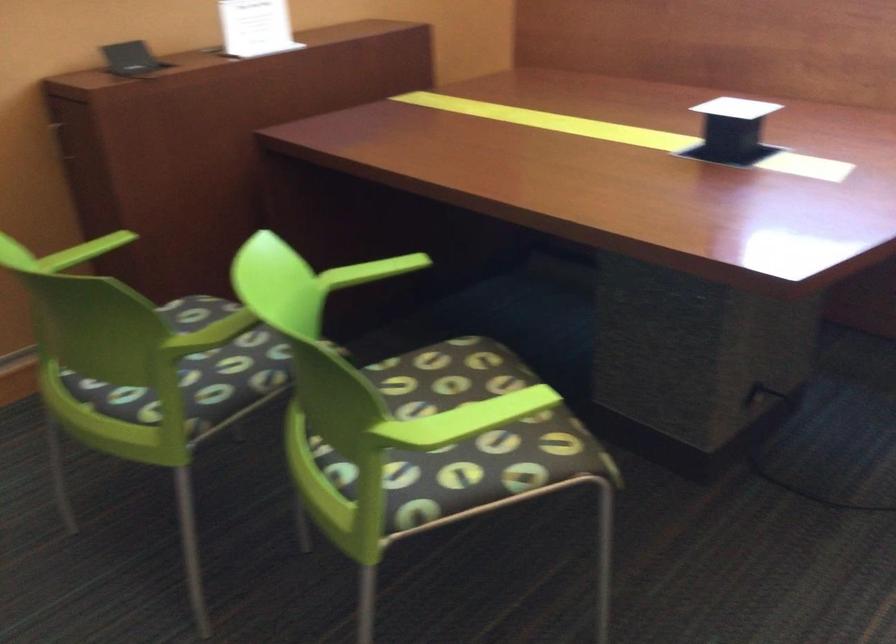
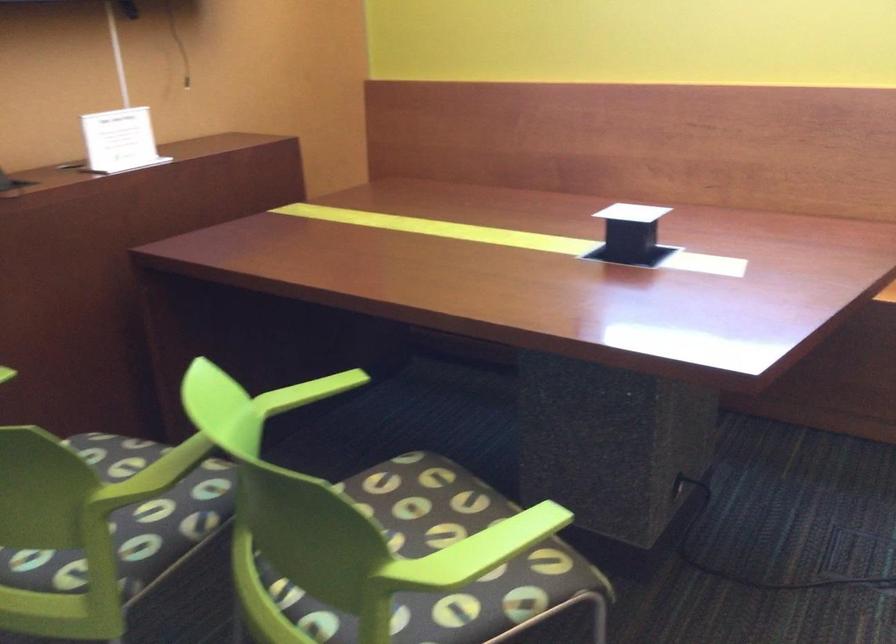
Where in the second image is the point corresponding to (373,270) from the first image?

(307, 392)